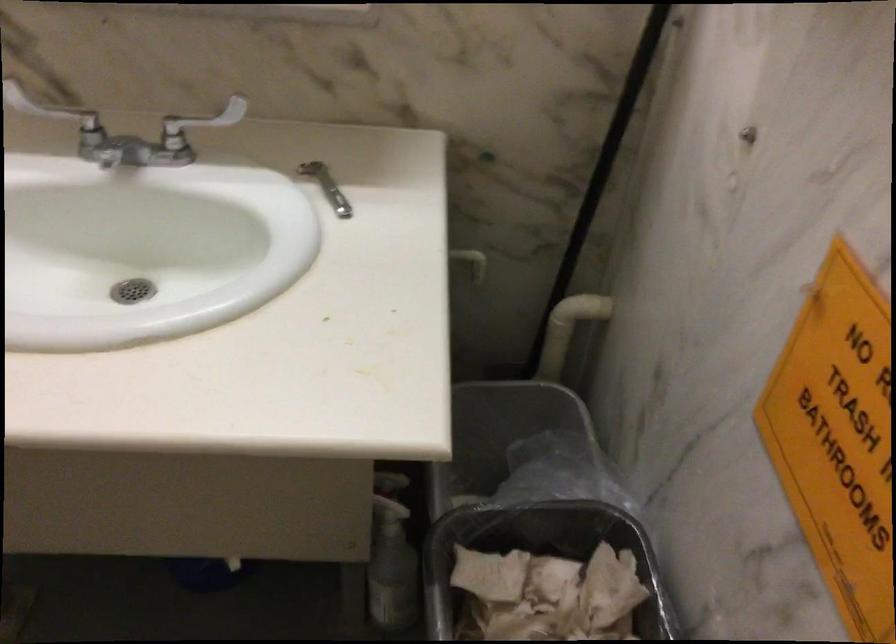
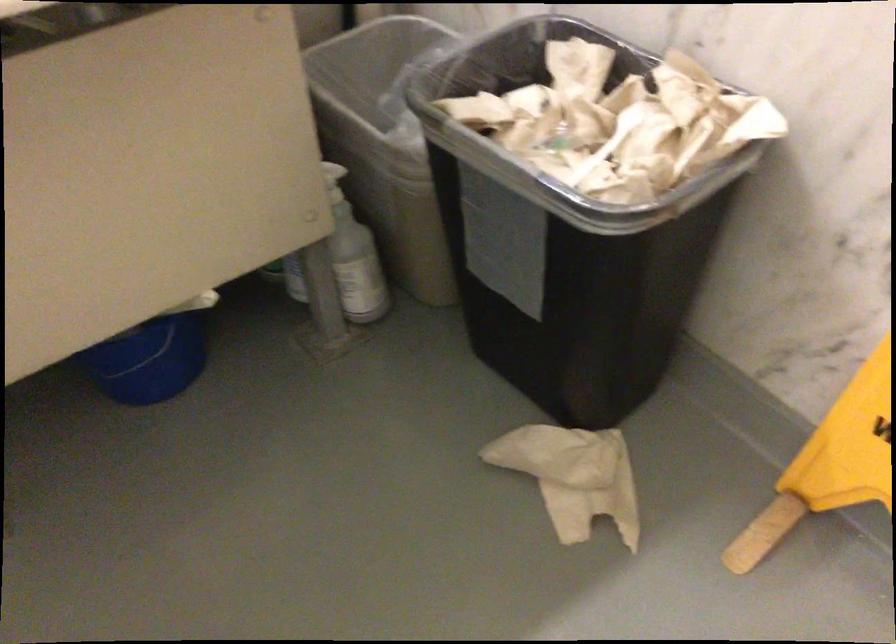
In the second image, find the point that corresponds to [386,513] in the first image.

(333, 182)